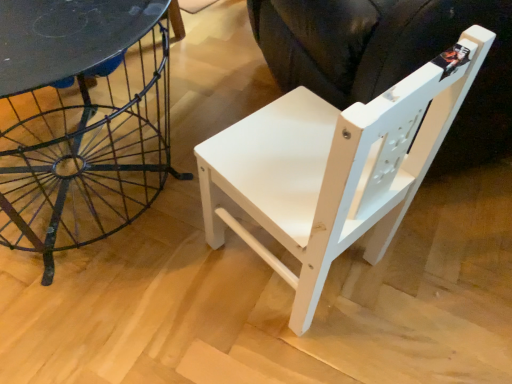
You are a GUI agent. You are given a task and a screenshot of the screen. Output one action in this format:
    pyautogui.click(x=<x>, y=<y>)
    Task: Click on the vacant point to the left of white matte wood chair at center
    The height and width of the screenshot is (384, 512).
    Given the screenshot: What is the action you would take?
    pyautogui.click(x=178, y=302)